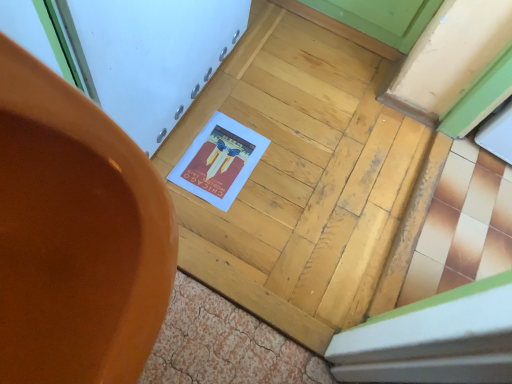
Question: Should I look upward or downward to see wooden door at center?

Choices:
 (A) up
 (B) down

Answer: (A)

Question: Is matte orange pot at center wider than wooden door at center?

Choices:
 (A) no
 (B) yes

Answer: (A)

Question: Is matte orange pot at center further to the viewer compared to wooden door at center?

Choices:
 (A) no
 (B) yes

Answer: (A)

Question: From the image's perspective, is matte orange pot at center located above wooden door at center?

Choices:
 (A) yes
 (B) no

Answer: (B)

Question: Is matte orange pot at center taller than wooden door at center?

Choices:
 (A) no
 (B) yes

Answer: (B)

Question: From the image's perspective, is matte orange pot at center beneath wooden door at center?

Choices:
 (A) yes
 (B) no

Answer: (A)

Question: Is matte orange pot at center located outside wooden door at center?

Choices:
 (A) no
 (B) yes

Answer: (B)

Question: Is wooden door at center oriented towards matte orange pot at center?

Choices:
 (A) no
 (B) yes

Answer: (A)

Question: Is wooden door at center smaller than matte orange pot at center?

Choices:
 (A) no
 (B) yes

Answer: (B)

Question: Is wooden door at center taller than matte orange pot at center?

Choices:
 (A) yes
 (B) no

Answer: (B)

Question: From the image's perspective, is wooden door at center beneath matte orange pot at center?

Choices:
 (A) no
 (B) yes

Answer: (A)

Question: Considering the relative sizes of wooden door at center and matte orange pot at center in the image provided, is wooden door at center wider than matte orange pot at center?

Choices:
 (A) yes
 (B) no

Answer: (A)

Question: Can you confirm if wooden door at center is thinner than matte orange pot at center?

Choices:
 (A) no
 (B) yes

Answer: (A)

Question: From the image's perspective, is wooden door at center positioned above or below matte orange pot at center?

Choices:
 (A) below
 (B) above

Answer: (B)